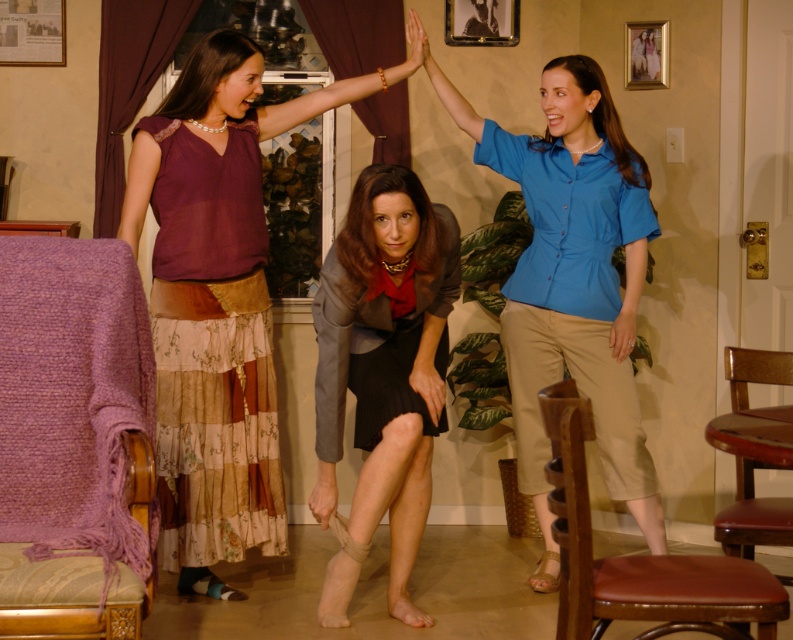
From the picture: You are a photographer trying to capture the interaction between the two women in the center of the image. You notice the gray fabric sleeve at center and the matte blue shirt at right. Which one is closer to the camera?

The gray fabric sleeve at center is positioned under the matte blue shirt at right, which means it is closer to the camera.